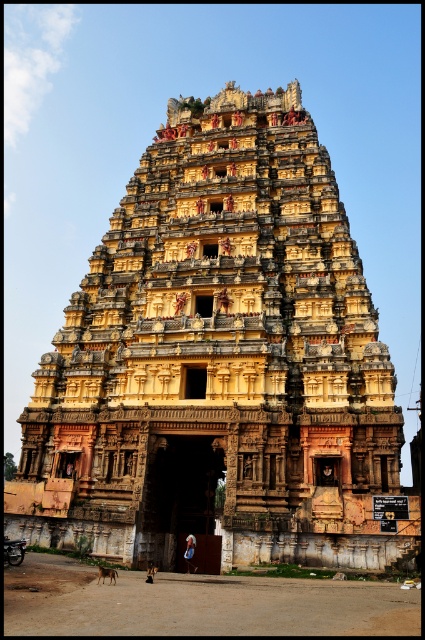
What do you see at coordinates (184, 499) in the screenshot?
I see `carved stone archway at center` at bounding box center [184, 499].

Is the position of carved stone archway at center less distant than that of blue fabric headscarf at center?

Yes.

Where is `carved stone archway at center`? The width and height of the screenshot is (425, 640). carved stone archway at center is located at coordinates (184, 499).

This screenshot has height=640, width=425. I want to click on carved stone archway at center, so click(184, 499).

Can you confirm if yellow stone hindu temple at center is positioned to the right of blue fabric headscarf at center?

Correct, you'll find yellow stone hindu temple at center to the right of blue fabric headscarf at center.

Is yellow stone hindu temple at center below blue fabric headscarf at center?

No.

Where is `yellow stone hindu temple at center`? yellow stone hindu temple at center is located at coordinates (218, 358).

This screenshot has width=425, height=640. Find the location of `yellow stone hindu temple at center`. yellow stone hindu temple at center is located at coordinates (218, 358).

Which is in front, point (328, 273) or point (158, 525)?

Point (158, 525)

Can you confirm if yellow stone hindu temple at center is positioned to the right of carved stone archway at center?

Correct, you'll find yellow stone hindu temple at center to the right of carved stone archway at center.

Who is more forward, (x=342, y=493) or (x=214, y=568)?

Point (x=342, y=493)

Where is `yellow stone hindu temple at center`? This screenshot has width=425, height=640. yellow stone hindu temple at center is located at coordinates (218, 358).